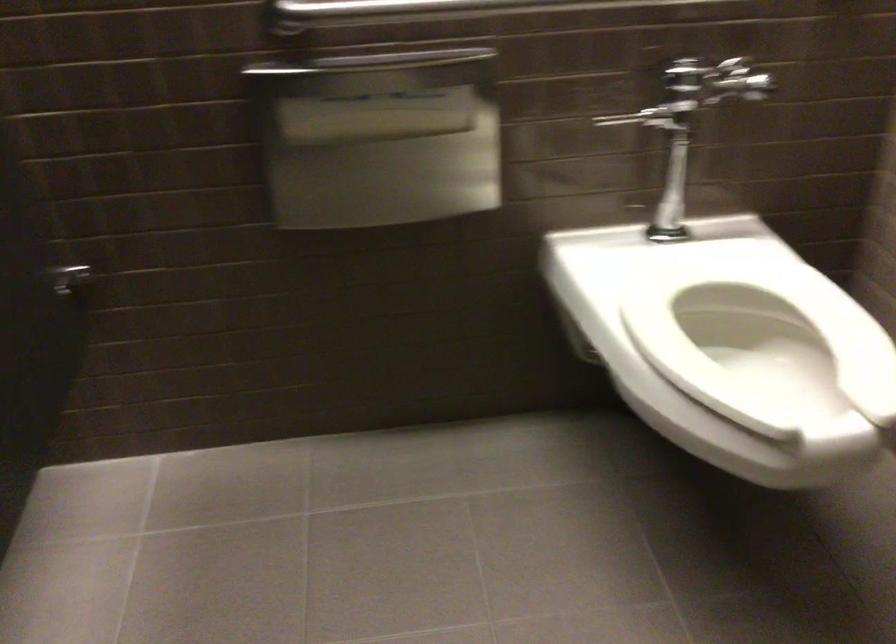
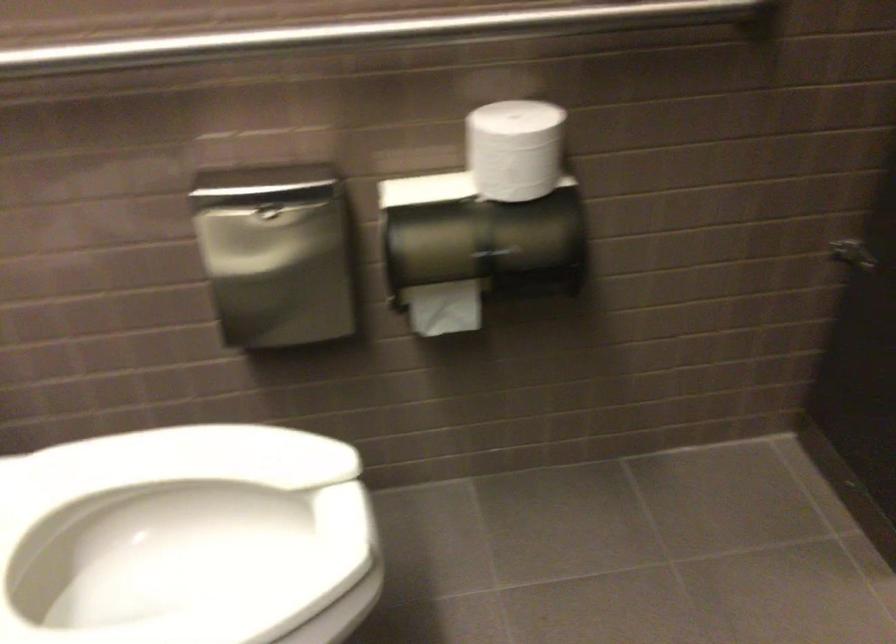
How did the camera likely rotate?

The camera rotated toward right-down.